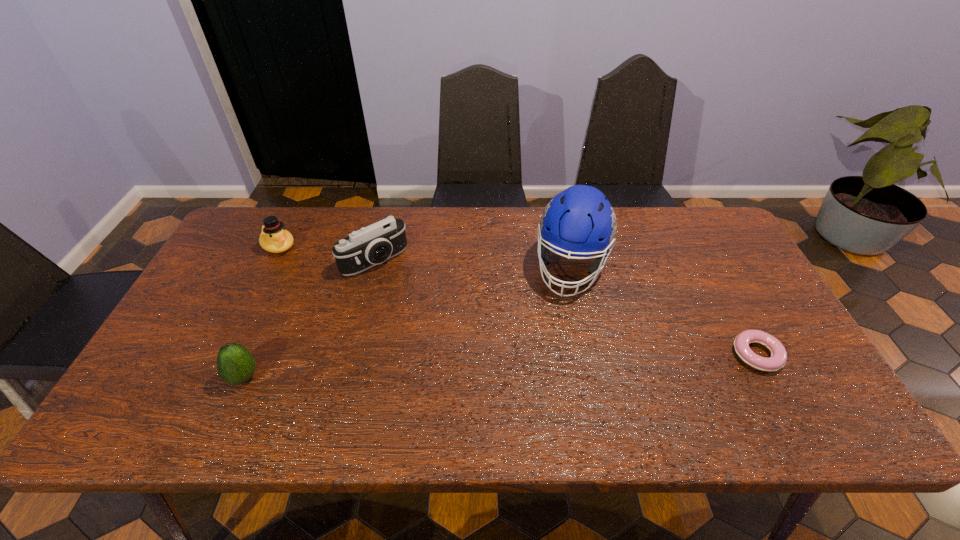
This screenshot has width=960, height=540. Identify the location of vacant space located 0.270m on the front lens of the camera. (444, 332).

Locate an element on the screen. This screenshot has height=540, width=960. free location located 0.110m on the front lens of the camera is located at coordinates (412, 296).

The width and height of the screenshot is (960, 540). What are the coordinates of `free location located 0.140m on the face guard of the fourth object from left to right` in the screenshot? It's located at (556, 340).

At what (x,y) coordinates should I click in order to perform the action: click on vacant space situated 0.260m on the face guard of the fourth object from left to right. Please return your answer as a coordinate pair (x, y). Looking at the image, I should click on (545, 379).

The image size is (960, 540). Find the location of `free location located on the face guard of the fourth object from left to right`. free location located on the face guard of the fourth object from left to right is located at coordinates (561, 320).

Identify the location of vacant space located on the front-facing side of the duck. This screenshot has height=540, width=960. (301, 264).

You are a GUI agent. You are given a task and a screenshot of the screen. Output one action in this format:
    pyautogui.click(x=<x>, y=<y>)
    Task: Click on the vacant space located 0.260m on the front-facing side of the duck
    The width and height of the screenshot is (960, 540).
    Given the screenshot: What is the action you would take?
    pyautogui.click(x=339, y=295)

What are the coordinates of `vacant area located 0.390m on the front-facing side of the duck` in the screenshot? It's located at (368, 319).

You are a GUI agent. You are given a task and a screenshot of the screen. Output one action in this format:
    pyautogui.click(x=<x>, y=<y>)
    Task: Click on the camera at the far edge
    The image size is (960, 540).
    Given the screenshot: What is the action you would take?
    pyautogui.click(x=374, y=244)

Where is `football helmet located at the far edge`? football helmet located at the far edge is located at coordinates (580, 221).